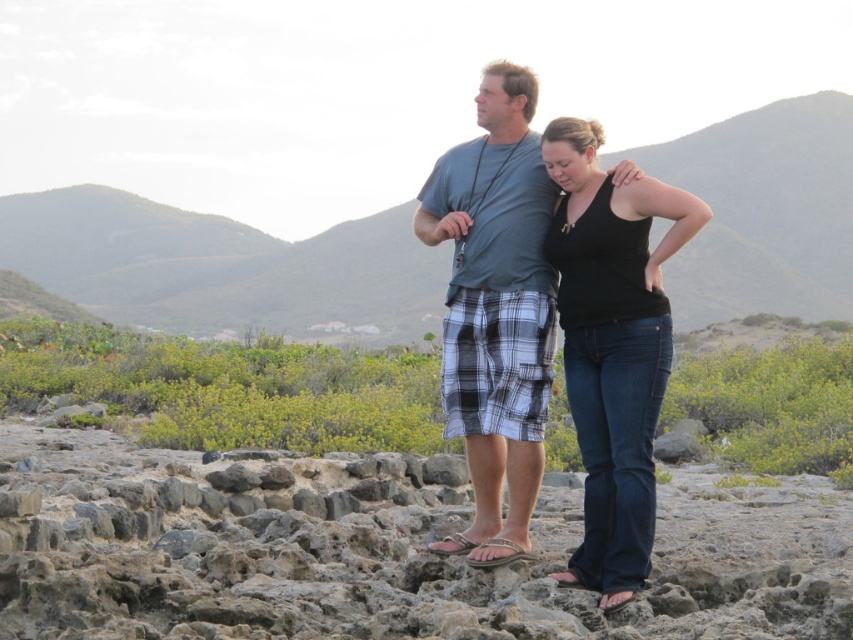
Which of these two, green grassy hill at upper center or gray plaid shorts at center, stands shorter?

Standing shorter between the two is gray plaid shorts at center.

Is point (780, 198) positioned before point (537, 234)?

No, (780, 198) is further to viewer.

This screenshot has height=640, width=853. What do you see at coordinates (221, 266) in the screenshot? I see `green grassy hill at upper center` at bounding box center [221, 266].

Identify the location of green grassy hill at upper center. This screenshot has height=640, width=853. (221, 266).

Can you confirm if gray plaid shorts at center is shorter than black denim jeans at center?

Indeed, gray plaid shorts at center has a lesser height compared to black denim jeans at center.

Is point (500, 125) behind point (631, 346)?

Yes, point (500, 125) is farther from viewer.

I want to click on gray plaid shorts at center, so click(495, 307).

Is the position of rusty stone at center less distant than that of black denim jeans at center?

That is True.

Who is more forward, [276,506] or [625,214]?

Point [625,214] is more forward.

Does point (105, 429) come closer to viewer compared to point (619, 532)?

No.

Where is `rusty stone at center`? rusty stone at center is located at coordinates (381, 552).